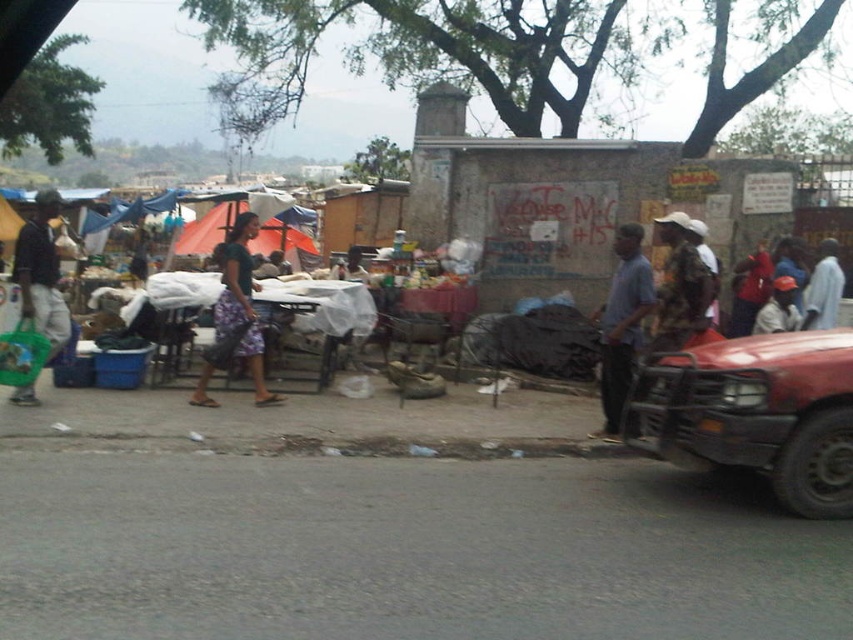
Based on the photo, between printed fabric skirt at center and orange fabric cap at lower right, which one appears on the left side from the viewer's perspective?

printed fabric skirt at center

Is printed fabric skirt at center to the left of orange fabric cap at lower right from the viewer's perspective?

Correct, you'll find printed fabric skirt at center to the left of orange fabric cap at lower right.

Describe the element at coordinates (235, 316) in the screenshot. I see `printed fabric skirt at center` at that location.

This screenshot has height=640, width=853. Find the location of `printed fabric skirt at center`. printed fabric skirt at center is located at coordinates (235, 316).

Does orange fabric tent at center have a smaller size compared to orange fabric cap at lower right?

No, orange fabric tent at center is not smaller than orange fabric cap at lower right.

What are the coordinates of `orange fabric tent at center` in the screenshot? It's located at (231, 224).

The height and width of the screenshot is (640, 853). What do you see at coordinates (749, 291) in the screenshot?
I see `red matte shirt at center` at bounding box center [749, 291].

Can you confirm if red matte shirt at center is positioned below orange fabric cap at lower right?

No.

Describe the element at coordinates (749, 291) in the screenshot. I see `red matte shirt at center` at that location.

The width and height of the screenshot is (853, 640). I want to click on red matte shirt at center, so click(x=749, y=291).